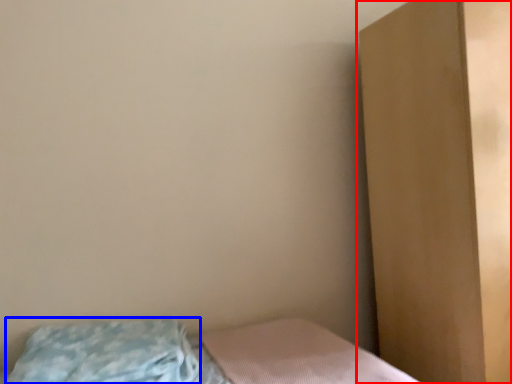
Question: Which object appears closest to the camera in this image, dresser (highlighted by a red box) or pillow (highlighted by a blue box)?

Choices:
 (A) dresser
 (B) pillow

Answer: (B)